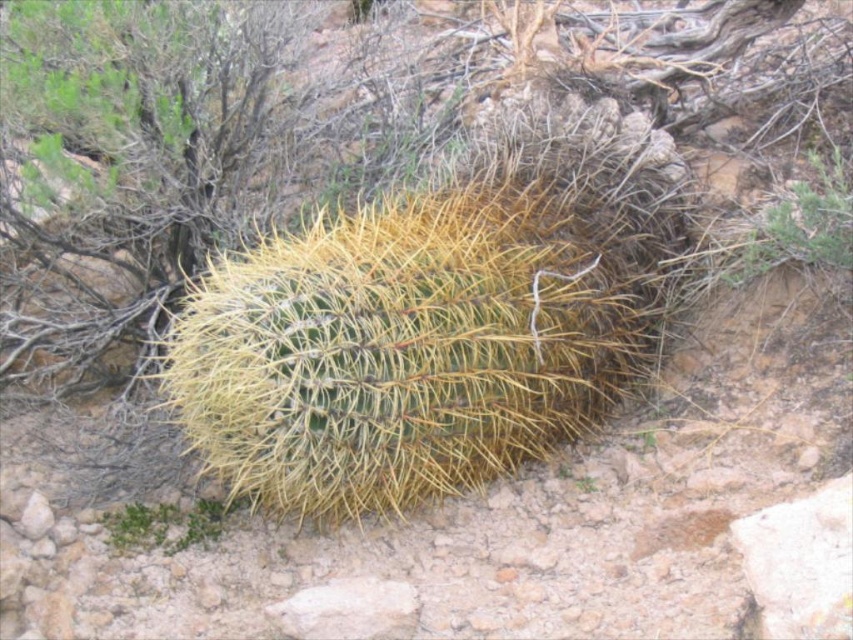
Between green spiky cactus at upper right and green spiky cactus at lower left, which one is positioned lower?

green spiky cactus at lower left

Is point (836, 227) positioned before point (157, 538)?

Yes, point (836, 227) is in front of point (157, 538).

Find the location of a particular element. This screenshot has height=640, width=853. green spiky cactus at upper right is located at coordinates (799, 221).